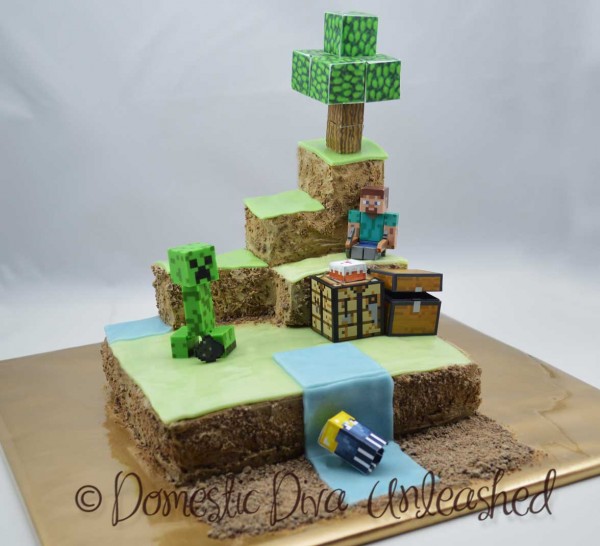
This screenshot has width=600, height=546. What are the coordinates of `chest` in the screenshot? It's located at (427, 323).